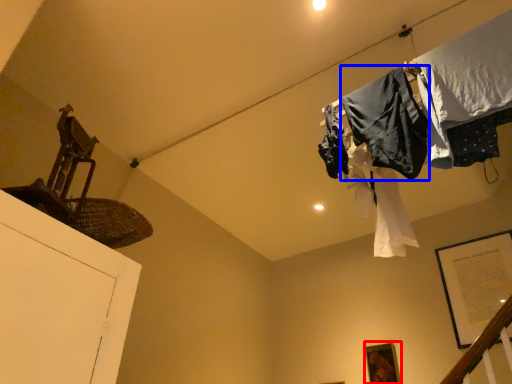
Question: Which of the following is the closest to the observer, picture frame (highlighted by a red box) or clothing (highlighted by a blue box)?

Choices:
 (A) picture frame
 (B) clothing

Answer: (B)